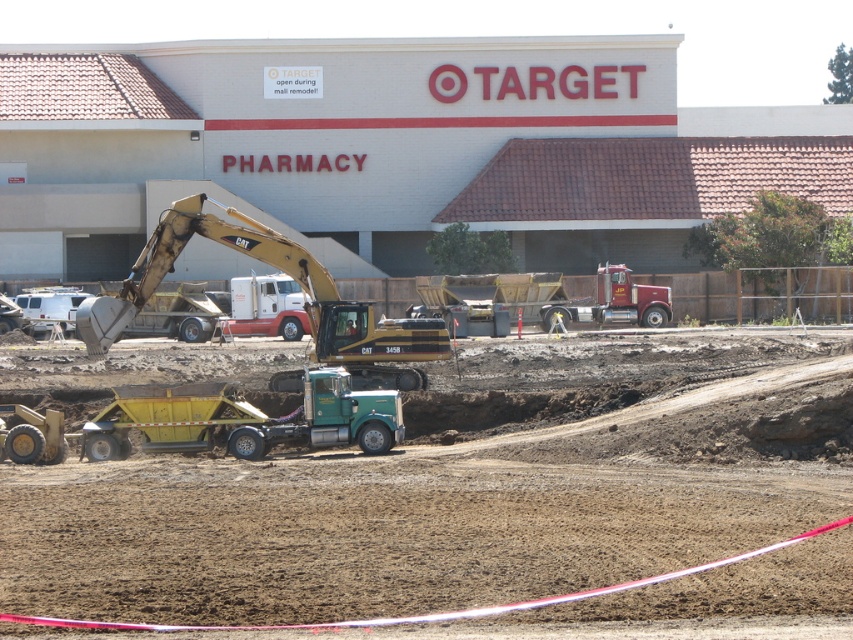
You are a delivery driver arriving at the Target construction site. You need to park your truck near the yellow metallic excavator at center and the green metallic trailer truck at center. Which vehicle should you park closer to if you want to avoid blocking the larger vehicle?

The yellow metallic excavator at center is bigger than the green metallic trailer truck at center, so you should park closer to the green metallic trailer truck at center to avoid blocking the larger vehicle.

You are a delivery driver who needs to park your truck near the construction site. The instructions say to park to the left of the brown sandy dirt at center. Where should you position your truck relative to the green metallic trailer truck at center?

The brown sandy dirt at center is to the right of the green metallic trailer truck at center. Therefore, to park to the left of the brown sandy dirt at center, you should position your truck to the left of the green metallic trailer truck at center.